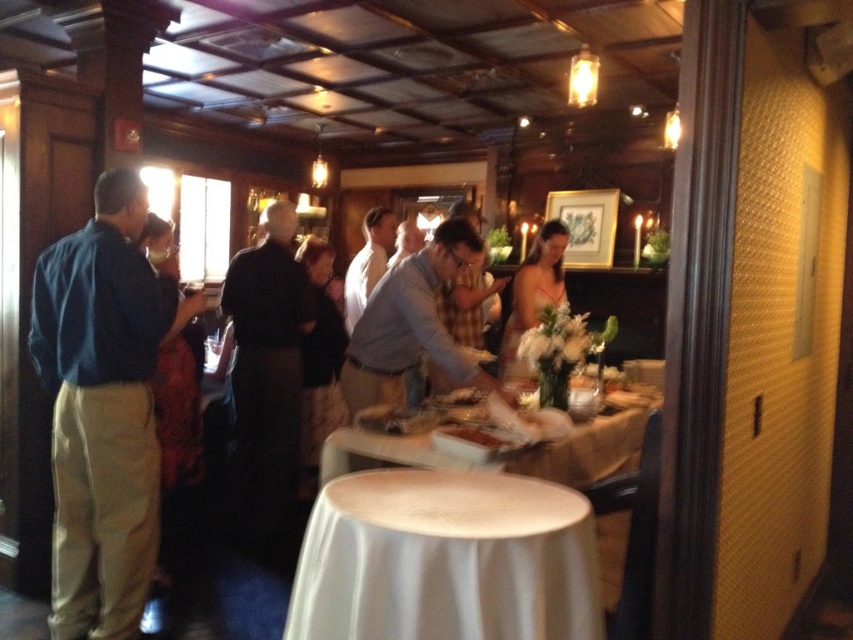
Who is higher up, blue shirt at left or white cloth table at center?

blue shirt at left is higher up.

Between point (67, 486) and point (410, 452), which one is positioned in front?

Point (410, 452) is in front.

Locate an element on the screen. blue shirt at left is located at coordinates (103, 408).

Between blue shirt at left and white cloth at lower center, which one appears on the right side from the viewer's perspective?

From the viewer's perspective, white cloth at lower center appears more on the right side.

Is blue shirt at left smaller than white cloth at lower center?

No, blue shirt at left is not smaller than white cloth at lower center.

The image size is (853, 640). I want to click on blue shirt at left, so click(103, 408).

Who is higher up, black matte shirt at center or matte orange dress at center?

Positioned higher is matte orange dress at center.

Between black matte shirt at center and matte orange dress at center, which one has more height?

black matte shirt at center

Image resolution: width=853 pixels, height=640 pixels. Describe the element at coordinates (265, 369) in the screenshot. I see `black matte shirt at center` at that location.

Image resolution: width=853 pixels, height=640 pixels. What are the coordinates of `black matte shirt at center` in the screenshot? It's located at (265, 369).